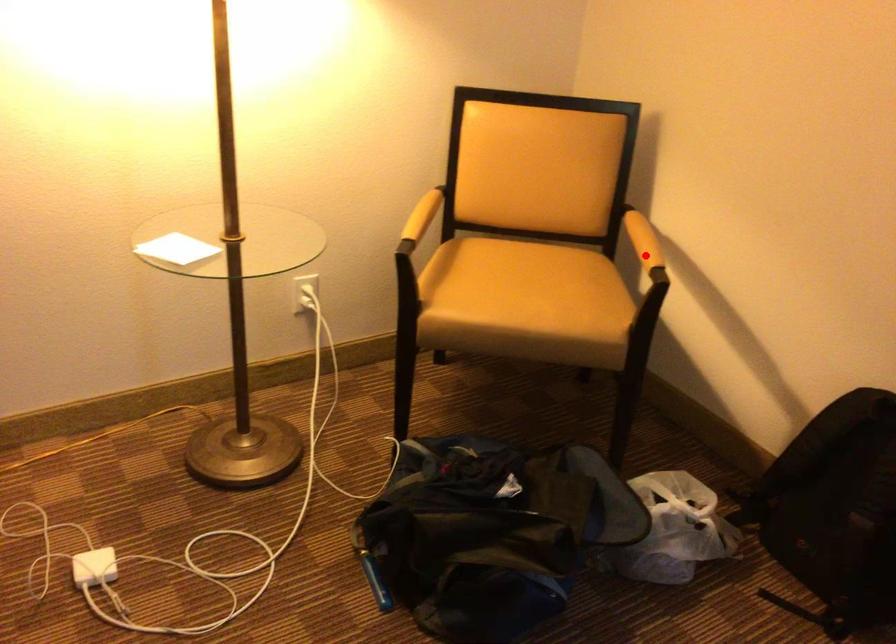
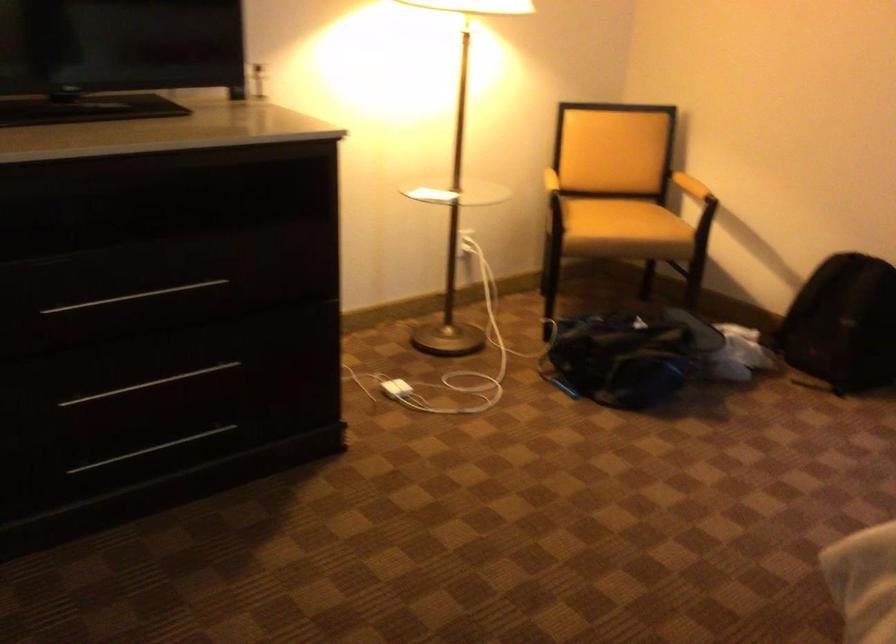
Question: I am providing you with two images of the same scene from different viewpoints. In image1, a red point is highlighted. Considering the same 3D point in image2, which of the following is correct?

Choices:
 (A) It is closer
 (B) It is farther

Answer: (B)